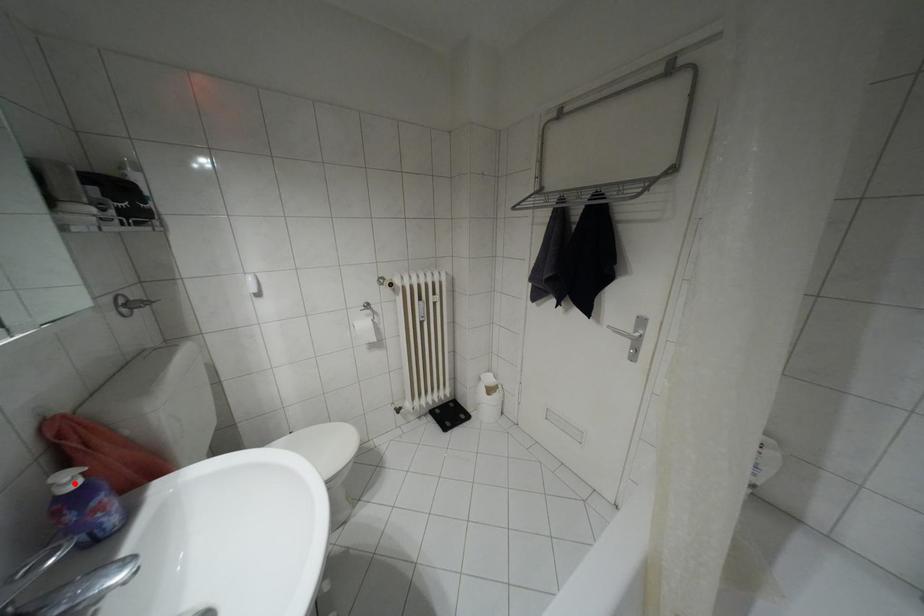
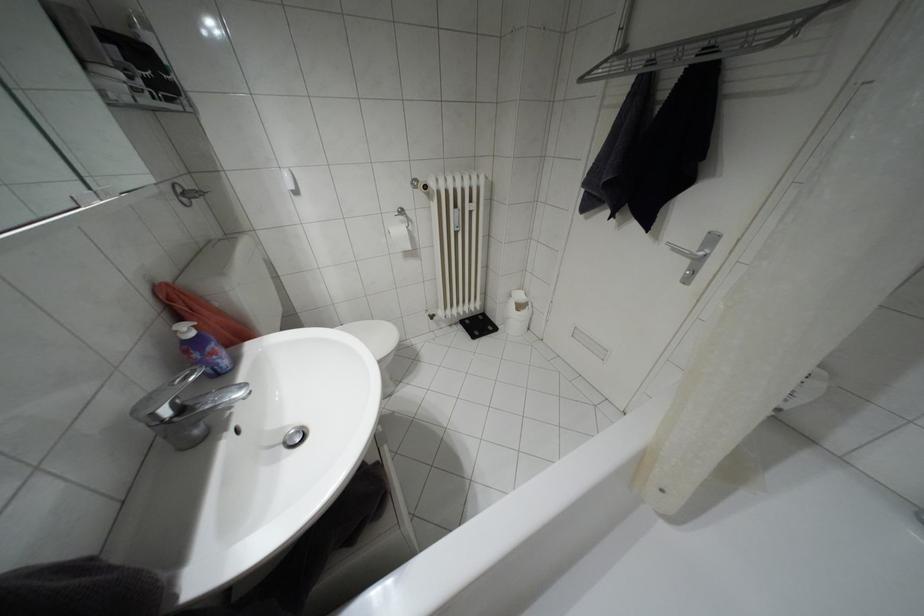
Question: I am providing you with two images of the same scene from different viewpoints. Given a red point in image1, look at the same physical point in image2. Is it:

Choices:
 (A) Closer to the viewpoint
 (B) Farther from the viewpoint

Answer: (A)